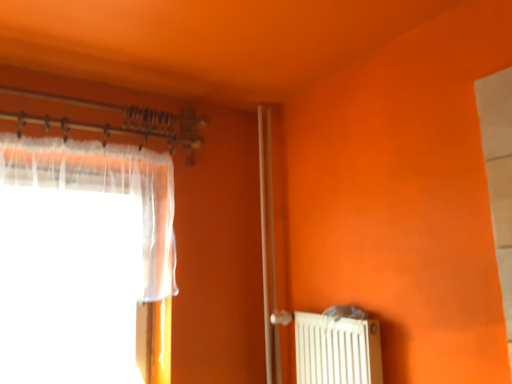
At what (x,y) coordinates should I click in order to perform the action: click on clear glass screen door at center. Please return your answer as a coordinate pair (x, y). Looking at the image, I should click on coord(273,238).

At what (x,y) coordinates should I click in order to perform the action: click on white matte radiator at lower right. Please return your answer as a coordinate pair (x, y). Image resolution: width=512 pixels, height=384 pixels. Looking at the image, I should click on (337, 350).

Where is `translucent fabric curtain at left`? translucent fabric curtain at left is located at coordinates (79, 257).

Measure the distance between translucent fabric curtain at left and camera.

translucent fabric curtain at left is 4.64 feet away from camera.

Where is `clear glass screen door at center`? The width and height of the screenshot is (512, 384). clear glass screen door at center is located at coordinates (273, 238).

From a real-world perspective, is translucent fabric curtain at left above or below white matte radiator at lower right?

translucent fabric curtain at left is situated higher than white matte radiator at lower right in the real world.

Which object is closer to the camera, translucent fabric curtain at left or white matte radiator at lower right?

Positioned in front is translucent fabric curtain at left.

Is translucent fabric curtain at left smaller than white matte radiator at lower right?

Actually, translucent fabric curtain at left might be larger than white matte radiator at lower right.

Does translucent fabric curtain at left have a greater height compared to white matte radiator at lower right?

Yes.

Between clear glass screen door at center and translucent fabric curtain at left, which one has smaller size?

With smaller size is clear glass screen door at center.

Based on their positions, is clear glass screen door at center located to the left or right of translucent fabric curtain at left?

clear glass screen door at center is positioned on translucent fabric curtain at left's right side.

Is clear glass screen door at center wider or thinner than translucent fabric curtain at left?

Considering their sizes, clear glass screen door at center looks slimmer than translucent fabric curtain at left.

Is point (274, 122) positioned after point (164, 259)?

Yes.

Which object is further away from the camera, white matte radiator at lower right or translucent fabric curtain at left?

Positioned behind is white matte radiator at lower right.

Is white matte radiator at lower right wider than translucent fabric curtain at left?

In fact, white matte radiator at lower right might be narrower than translucent fabric curtain at left.

Which is more to the left, white matte radiator at lower right or translucent fabric curtain at left?

translucent fabric curtain at left is more to the left.

Considering the positions of point (376, 331) and point (10, 198), is point (376, 331) closer or farther from the camera than point (10, 198)?

Point (376, 331).

Which is more to the right, white matte radiator at lower right or clear glass screen door at center?

white matte radiator at lower right.

Does white matte radiator at lower right come in front of clear glass screen door at center?

Yes, it is.

Which of these two, white matte radiator at lower right or clear glass screen door at center, stands shorter?

With less height is white matte radiator at lower right.

Is translucent fabric curtain at left with clear glass screen door at center?

No, translucent fabric curtain at left is not next to clear glass screen door at center.

Is translucent fabric curtain at left located outside clear glass screen door at center?

Yes, translucent fabric curtain at left is not within clear glass screen door at center.

Based on the photo, which is more to the left, translucent fabric curtain at left or clear glass screen door at center?

From the viewer's perspective, translucent fabric curtain at left appears more on the left side.

Which is closer to the camera, (109, 352) or (280, 136)?

Point (109, 352).

Considering the relative positions of clear glass screen door at center and white matte radiator at lower right in the image provided, is clear glass screen door at center in front of white matte radiator at lower right?

No, clear glass screen door at center is further to the viewer.

You are a GUI agent. You are given a task and a screenshot of the screen. Output one action in this format:
    pyautogui.click(x=<x>, y=<y>)
    Task: Click on the screen door that is above the white matte radiator at lower right (from the image's perspective)
    The height and width of the screenshot is (384, 512).
    Given the screenshot: What is the action you would take?
    coord(273,238)

From the image's perspective, which is above, clear glass screen door at center or white matte radiator at lower right?

clear glass screen door at center appears higher in the image.

In the image, there is a white matte radiator at lower right. Where is `curtain above it (from the image's perspective)`? The width and height of the screenshot is (512, 384). curtain above it (from the image's perspective) is located at coordinates (79, 257).

The height and width of the screenshot is (384, 512). In order to click on curtain on the left of clear glass screen door at center in this screenshot , I will do `click(79, 257)`.

Based on their spatial positions, is translucent fabric curtain at left or white matte radiator at lower right further from clear glass screen door at center?

Among the two, translucent fabric curtain at left is located further to clear glass screen door at center.

From the image, which object appears to be nearer to translucent fabric curtain at left, white matte radiator at lower right or clear glass screen door at center?

clear glass screen door at center lies closer to translucent fabric curtain at left than the other object.

Considering their positions, is clear glass screen door at center positioned closer to translucent fabric curtain at left than white matte radiator at lower right?

clear glass screen door at center lies closer to translucent fabric curtain at left than the other object.

Based on their spatial positions, is translucent fabric curtain at left or clear glass screen door at center further from white matte radiator at lower right?

translucent fabric curtain at left is further to white matte radiator at lower right.

Considering their positions, is clear glass screen door at center positioned further to white matte radiator at lower right than translucent fabric curtain at left?

translucent fabric curtain at left is further to white matte radiator at lower right.

Estimate the real-world distances between objects in this image. Which object is further from clear glass screen door at center, white matte radiator at lower right or translucent fabric curtain at left?

The object further to clear glass screen door at center is translucent fabric curtain at left.

Image resolution: width=512 pixels, height=384 pixels. Identify the location of screen door situated between translucent fabric curtain at left and white matte radiator at lower right from left to right. (273, 238).